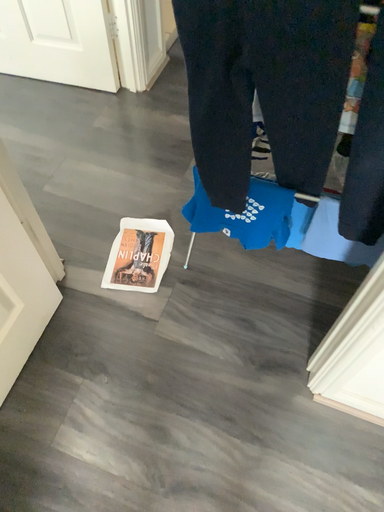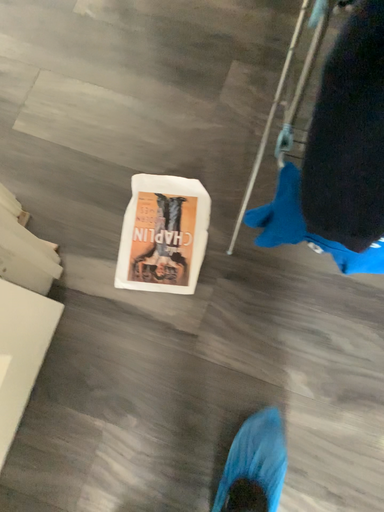
Question: How did the camera likely rotate when shooting the video?

Choices:
 (A) rotated upward
 (B) rotated downward

Answer: (B)